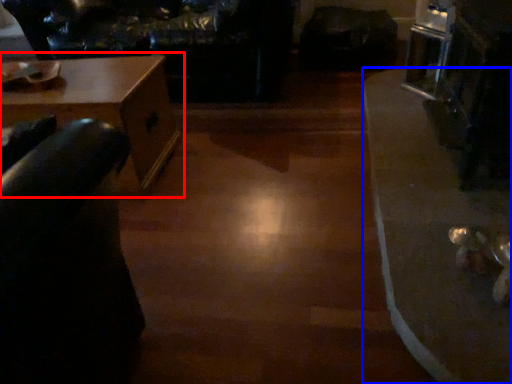
Question: Which object is closer to the camera taking this photo, table (highlighted by a red box) or table (highlighted by a blue box)?

Choices:
 (A) table
 (B) table

Answer: (B)